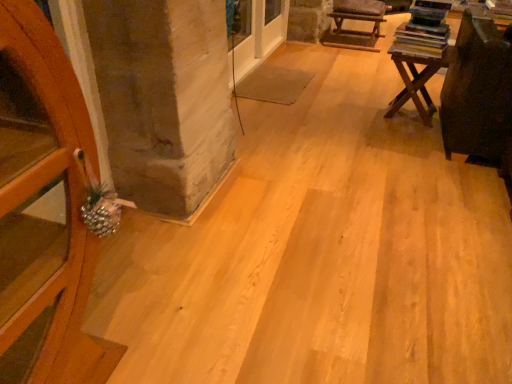
Question: Is wooden table at right positioned beyond the bounds of brown leather armchair at upper right?

Choices:
 (A) no
 (B) yes

Answer: (B)

Question: Is wooden table at right wider than brown leather armchair at upper right?

Choices:
 (A) yes
 (B) no

Answer: (B)

Question: Does wooden table at right come behind brown leather armchair at upper right?

Choices:
 (A) no
 (B) yes

Answer: (A)

Question: Is wooden table at right taller than brown leather armchair at upper right?

Choices:
 (A) yes
 (B) no

Answer: (A)

Question: Considering the relative sizes of wooden table at right and brown leather armchair at upper right in the image provided, is wooden table at right shorter than brown leather armchair at upper right?

Choices:
 (A) no
 (B) yes

Answer: (A)

Question: Is brown leather armchair at upper right a part of wooden table at right?

Choices:
 (A) yes
 (B) no

Answer: (B)

Question: Is the position of brown leather armchair at upper right more distant than that of wooden table at right?

Choices:
 (A) no
 (B) yes

Answer: (B)

Question: From a real-world perspective, is brown leather armchair at upper right located higher than wooden table at right?

Choices:
 (A) no
 (B) yes

Answer: (A)

Question: Is brown leather armchair at upper right thinner than wooden table at right?

Choices:
 (A) yes
 (B) no

Answer: (B)

Question: Is brown leather armchair at upper right facing away from wooden table at right?

Choices:
 (A) yes
 (B) no

Answer: (B)

Question: From the image's perspective, is brown leather armchair at upper right beneath wooden table at right?

Choices:
 (A) yes
 (B) no

Answer: (B)

Question: Does brown leather armchair at upper right have a lesser height compared to wooden table at right?

Choices:
 (A) no
 (B) yes

Answer: (B)

Question: Is wooden table at right wider or thinner than brown leather armchair at upper right?

Choices:
 (A) wide
 (B) thin

Answer: (B)